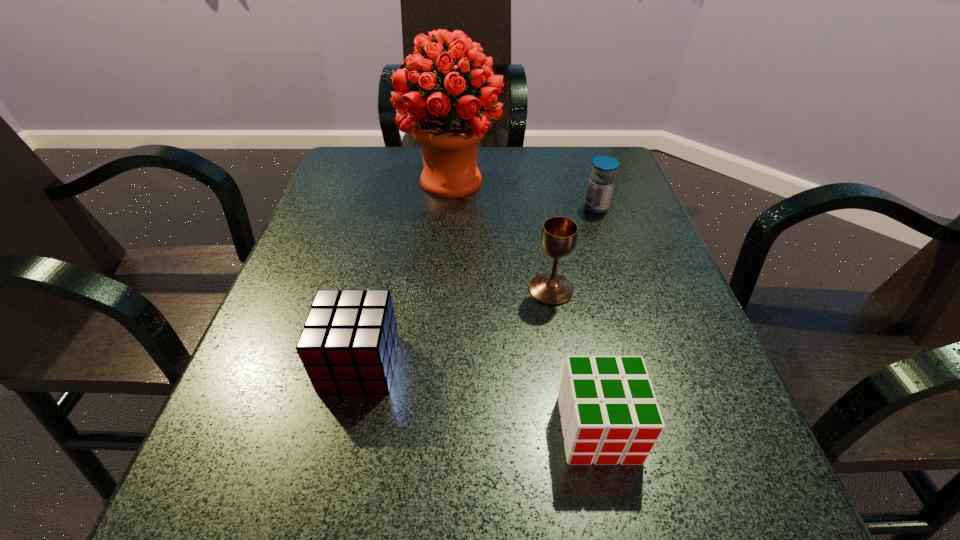
Locate an element on the screen. Image resolution: width=960 pixels, height=540 pixels. free spot between the medicine and the farther cube is located at coordinates (478, 285).

The image size is (960, 540). What are the coordinates of `free area in between the tallest object and the rightmost object` in the screenshot? It's located at (524, 194).

The image size is (960, 540). I want to click on unoccupied position between the tallest object and the right cube, so click(x=525, y=305).

This screenshot has height=540, width=960. I want to click on the closest object relative to the chalice, so click(x=609, y=415).

The width and height of the screenshot is (960, 540). I want to click on object that is the third closest one to the medicine, so click(x=609, y=415).

I want to click on free region that satisfies the following two spatial constraints: 1. on the back side of the rightmost object; 2. on the right side of the second tallest object, so click(538, 207).